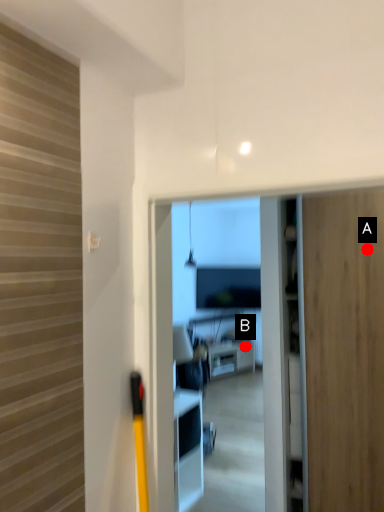
Question: Two points are circled on the image, labeled by A and B beside each circle. Which point is farther to the camera?

Choices:
 (A) A is further
 (B) B is further

Answer: (B)